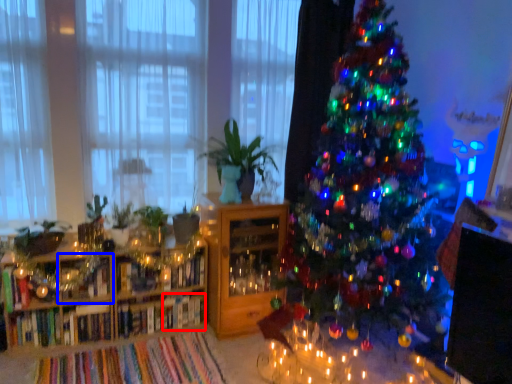
Question: Which object appears closest to the camera in this image, book (highlighted by a red box) or shelf (highlighted by a blue box)?

Choices:
 (A) book
 (B) shelf

Answer: (B)